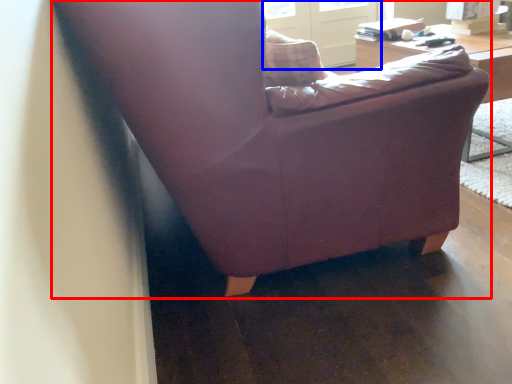
Question: Among these objects, which one is nearest to the camera, chair (highlighted by a red box) or screen door (highlighted by a blue box)?

Choices:
 (A) chair
 (B) screen door

Answer: (A)